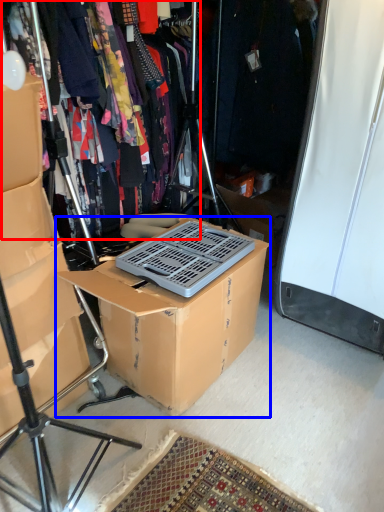
Question: Which object is further to the camera taking this photo, clothing (highlighted by a red box) or box (highlighted by a blue box)?

Choices:
 (A) clothing
 (B) box

Answer: (A)